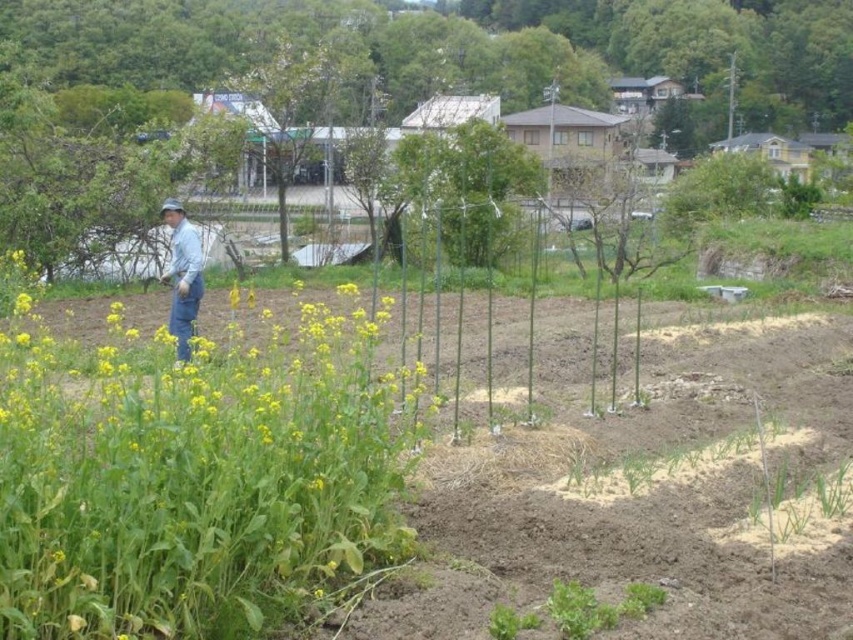
Is green leafy tree at upper center positioned behind blue denim jeans at center?

Yes, it is.

Who is more forward, [451,13] or [184,220]?

Point [184,220]

Which is behind, point (167, 88) or point (177, 342)?

The point (167, 88) is more distant.

You are a GUI agent. You are given a task and a screenshot of the screen. Output one action in this format:
    pyautogui.click(x=<x>, y=<y>)
    Task: Click on the green leafy tree at upper center
    The width and height of the screenshot is (853, 640).
    Given the screenshot: What is the action you would take?
    pyautogui.click(x=476, y=49)

Which of these two, green leafy plant at center or blue denim jeans at center, stands taller?

Standing taller between the two is blue denim jeans at center.

Can you confirm if green leafy plant at center is positioned to the right of blue denim jeans at center?

Correct, you'll find green leafy plant at center to the right of blue denim jeans at center.

Is point (57, 400) in front of point (192, 314)?

Yes.

This screenshot has width=853, height=640. Identify the location of green leafy plant at center. (195, 480).

Is point (119, 522) closer to camera compared to point (294, 120)?

Yes, it is.

Does green leafy plant at center have a smaller size compared to green leafy tree at center?

Correct, green leafy plant at center occupies less space than green leafy tree at center.

Between point (165, 520) and point (281, 52), which one is positioned in front?

Point (165, 520) is in front.

Identify the location of green leafy plant at center. (195, 480).